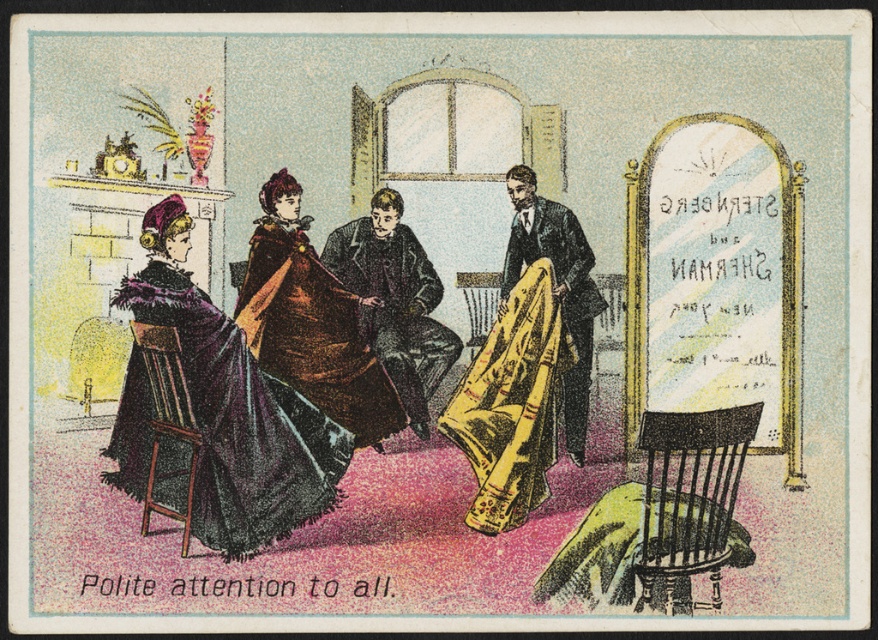
Question: Can you confirm if wooden chair at lower right is bigger than matte yellow fabric at center?

Choices:
 (A) yes
 (B) no

Answer: (A)

Question: Among these points, which one is nearest to the camera?

Choices:
 (A) (524, 259)
 (B) (300, 243)

Answer: (B)

Question: Can you confirm if velvet purple dress at left is smaller than yellow satin dress at center?

Choices:
 (A) yes
 (B) no

Answer: (B)

Question: Estimate the real-world distances between objects in this image. Which object is farther from the wooden chair at center?

Choices:
 (A) yellow satin dress at center
 (B) velvet brown coat at center

Answer: (A)

Question: Based on their relative distances, which object is farther from the wooden chair at center?

Choices:
 (A) matte yellow fabric at center
 (B) wooden chair at lower left

Answer: (B)

Question: Is velvet purple dress at left above wooden chair at lower right?

Choices:
 (A) yes
 (B) no

Answer: (A)